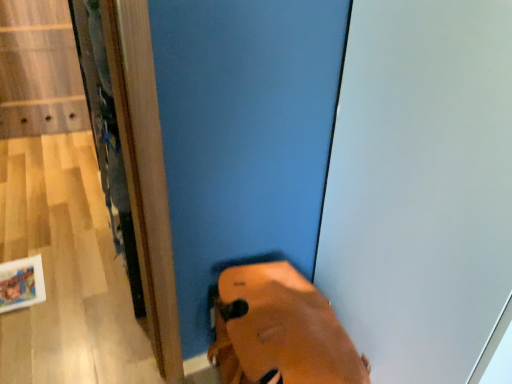
This screenshot has width=512, height=384. Describe the element at coordinates (280, 331) in the screenshot. I see `leather shoe at lower center` at that location.

The width and height of the screenshot is (512, 384). Find the location of `leather shoe at lower center`. leather shoe at lower center is located at coordinates (280, 331).

The width and height of the screenshot is (512, 384). What do you see at coordinates (421, 186) in the screenshot? I see `white glossy screen door at upper right` at bounding box center [421, 186].

Find the location of a particular element. white glossy screen door at upper right is located at coordinates (421, 186).

You are a GUI agent. You are given a task and a screenshot of the screen. Output one action in this format:
    pyautogui.click(x=<x>, y=<y>)
    Task: Click on the leather shoe at lower center
    
    Given the screenshot: What is the action you would take?
    pyautogui.click(x=280, y=331)

Between leather shoe at lower center and white glossy screen door at upper right, which one appears on the left side from the viewer's perspective?

leather shoe at lower center.

Is leather shoe at lower center behind white glossy screen door at upper right?

Yes, leather shoe at lower center is behind white glossy screen door at upper right.

Is point (239, 383) closer or farther from the camera than point (343, 156)?

Clearly, point (239, 383) is closer to the camera than point (343, 156).

From the image's perspective, is leather shoe at lower center located above white glossy screen door at upper right?

Incorrect, from the image's perspective, leather shoe at lower center is lower than white glossy screen door at upper right.

From a real-world perspective, which is physically above, leather shoe at lower center or white glossy screen door at upper right?

From a 3D spatial view, white glossy screen door at upper right is above.

Between leather shoe at lower center and white glossy screen door at upper right, which one has smaller width?

Thinner between the two is leather shoe at lower center.

Which of these two, leather shoe at lower center or white glossy screen door at upper right, stands shorter?

leather shoe at lower center.

Considering the relative sizes of leather shoe at lower center and white glossy screen door at upper right in the image provided, is leather shoe at lower center smaller than white glossy screen door at upper right?

Yes.

Is leather shoe at lower center inside the boundaries of white glossy screen door at upper right, or outside?

The correct answer is: outside.

Is leather shoe at lower center positioned far away from white glossy screen door at upper right?

No.

Is leather shoe at lower center turned away from white glossy screen door at upper right?

No, white glossy screen door at upper right is not at the back of leather shoe at lower center.

At what (x,y) coordinates should I click in order to perform the action: click on screen door above the leather shoe at lower center (from a real-world perspective). Please return your answer as a coordinate pair (x, y). Looking at the image, I should click on (421, 186).

Is white glossy screen door at upper right to the left of leather shoe at lower center from the viewer's perspective?

No.

Is white glossy screen door at upper right further to camera compared to leather shoe at lower center?

No.

Which point is more distant from viewer, (343, 112) or (223, 313)?

Point (223, 313)

From the image's perspective, which one is positioned lower, white glossy screen door at upper right or leather shoe at lower center?

→ leather shoe at lower center.

From a real-world perspective, is white glossy screen door at upper right positioned under leather shoe at lower center based on gravity?

No, from a real-world perspective, white glossy screen door at upper right is not below leather shoe at lower center.

Is white glossy screen door at upper right thinner than leather shoe at lower center?

Incorrect, the width of white glossy screen door at upper right is not less than that of leather shoe at lower center.

Can you confirm if white glossy screen door at upper right is shorter than leather shoe at lower center?

Incorrect, the height of white glossy screen door at upper right does not fall short of that of leather shoe at lower center.

Who is bigger, white glossy screen door at upper right or leather shoe at lower center?

white glossy screen door at upper right.

Would you say leather shoe at lower center is part of white glossy screen door at upper right's contents?

No, white glossy screen door at upper right does not contain leather shoe at lower center.

Is white glossy screen door at upper right next to leather shoe at lower center and touching it?

No, white glossy screen door at upper right is not in contact with leather shoe at lower center.

Is white glossy screen door at upper right turned away from leather shoe at lower center?

white glossy screen door at upper right does not have its back to leather shoe at lower center.

How different are the orientations of white glossy screen door at upper right and leather shoe at lower center in degrees?

The angular difference between white glossy screen door at upper right and leather shoe at lower center is 0.247 degrees.

Where is `footwear below the white glossy screen door at upper right (from the image's perspective)`? This screenshot has height=384, width=512. footwear below the white glossy screen door at upper right (from the image's perspective) is located at coordinates (280, 331).

The height and width of the screenshot is (384, 512). In order to click on footwear below the white glossy screen door at upper right (from the image's perspective) in this screenshot , I will do `click(280, 331)`.

Locate an element on the screen. The width and height of the screenshot is (512, 384). screen door above the leather shoe at lower center (from a real-world perspective) is located at coordinates (421, 186).